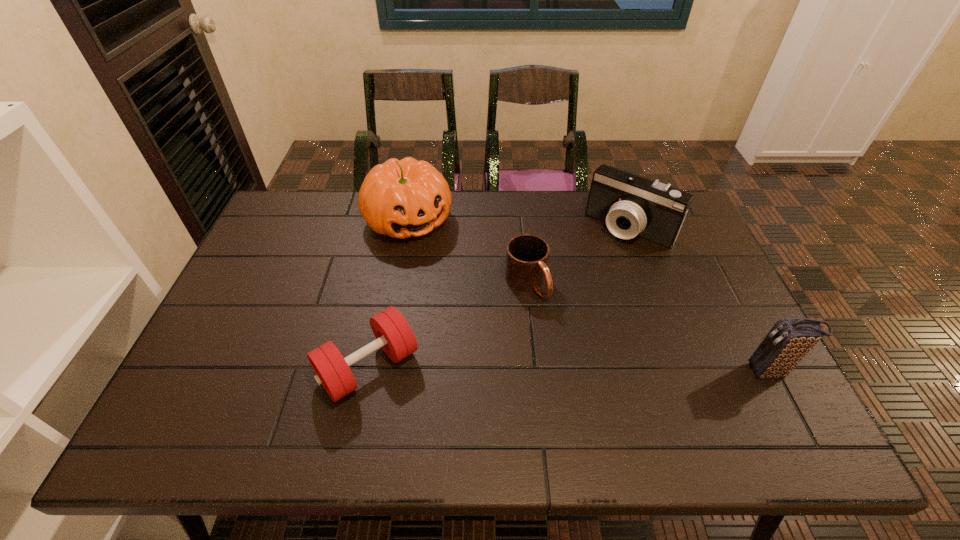
Identify the location of vacant space on the desktop that is between the dumbbell and the rightmost object and is positioned on the side of the third object from right to left with the handle. (601, 369).

This screenshot has height=540, width=960. In order to click on vacant spot on the desktop that is between the dumbbell and the rightmost object and is positioned on the carved face of the pumpkin in this screenshot , I will do `click(520, 369)`.

At what (x,y) coordinates should I click in order to perform the action: click on free space on the desktop that is between the dumbbell and the rightmost object and is positioned on the lens of the camcorder. Please return your answer as a coordinate pair (x, y). The height and width of the screenshot is (540, 960). Looking at the image, I should click on (519, 369).